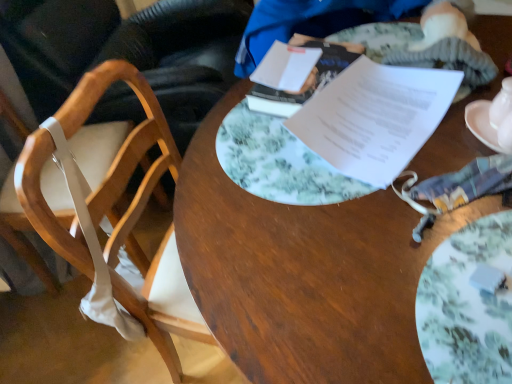
In order to click on blank area to the left of white ceramic saucer at right in this screenshot , I will do `click(414, 159)`.